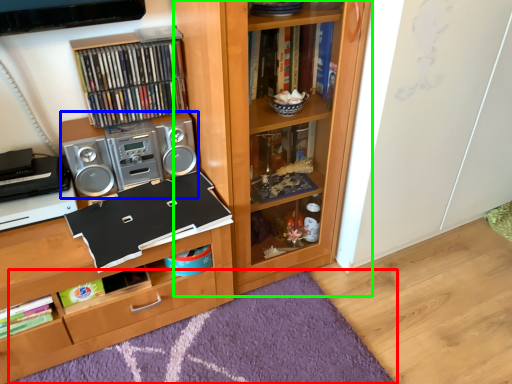
Question: Considering the real-world distances, which object is closest to mat (highlighted by a red box)? stereo (highlighted by a blue box) or bookcase (highlighted by a green box).

Choices:
 (A) stereo
 (B) bookcase

Answer: (B)